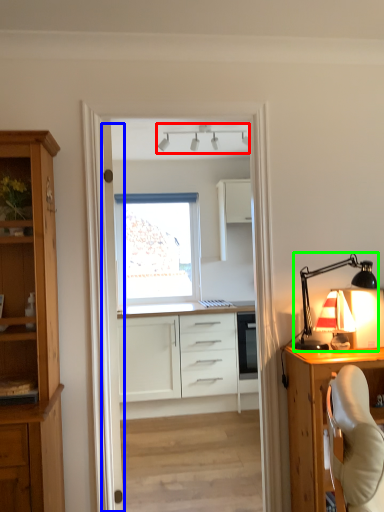
Question: Estimate the real-world distances between objects in this image. Which object is farther from lamp (highlighted by a red box), door (highlighted by a blue box) or lamp (highlighted by a green box)?

Choices:
 (A) door
 (B) lamp

Answer: (A)